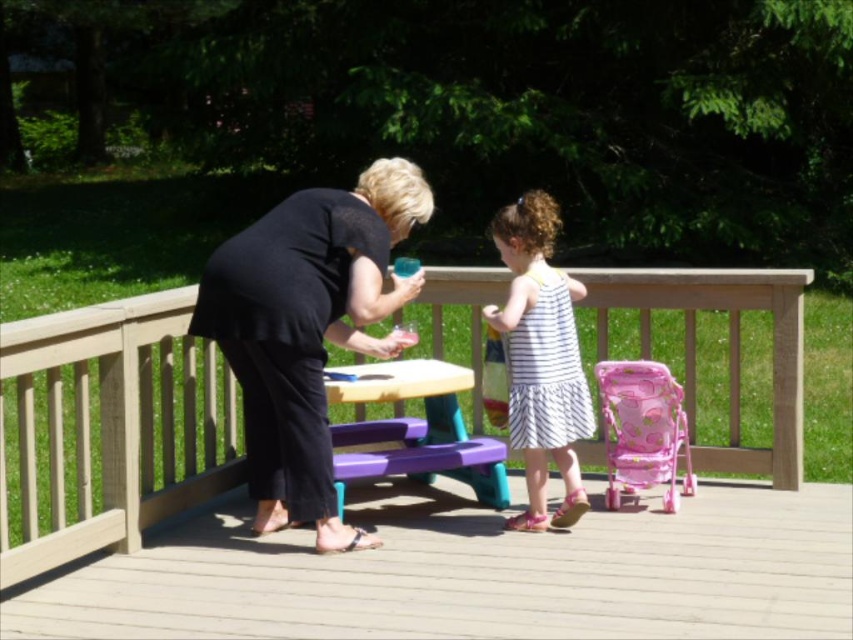
Does white striped dress at center have a larger size compared to purple plastic picnic table at center?

Incorrect, white striped dress at center is not larger than purple plastic picnic table at center.

Who is shorter, white striped dress at center or purple plastic picnic table at center?

purple plastic picnic table at center is shorter.

Between point (566, 502) and point (469, 458), which one is positioned in front?

Positioned in front is point (566, 502).

Locate an element on the screen. This screenshot has height=640, width=853. white striped dress at center is located at coordinates (541, 358).

Is wooden picnic table at center closer to the viewer compared to purple plastic picnic table at center?

Yes, it is in front of purple plastic picnic table at center.

Find the location of a particular element. This screenshot has height=640, width=853. wooden picnic table at center is located at coordinates (466, 582).

Which is above, wooden picnic table at center or black matte dress at center?

black matte dress at center is higher up.

Is point (706, 534) closer to viewer compared to point (215, 264)?

No.

Is point (717, 605) positioned after point (322, 275)?

No, it is not.

You are a GUI agent. You are given a task and a screenshot of the screen. Output one action in this format:
    pyautogui.click(x=<x>, y=<y>)
    Task: Click on the wooden picnic table at center
    The width and height of the screenshot is (853, 640).
    Given the screenshot: What is the action you would take?
    pyautogui.click(x=466, y=582)